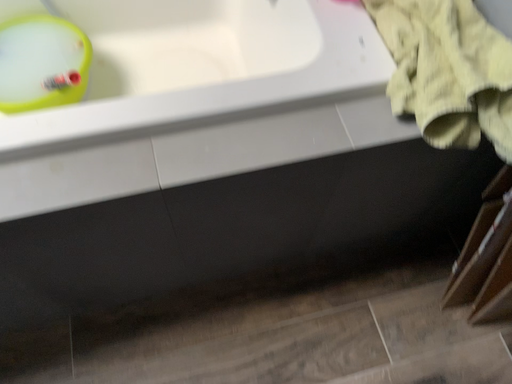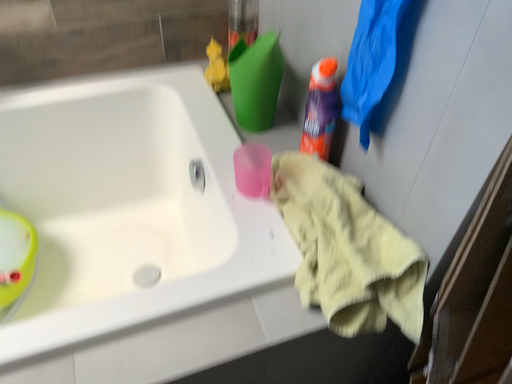
Question: How did the camera likely rotate when shooting the video?

Choices:
 (A) rotated upward
 (B) rotated downward

Answer: (A)